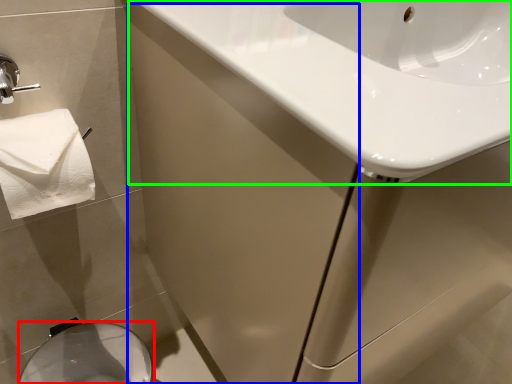
Question: Based on their relative distances, which object is farther from bidet (highlighted by a red box)? Choose from screen door (highlighted by a blue box) and sink (highlighted by a green box).

Choices:
 (A) screen door
 (B) sink

Answer: (B)